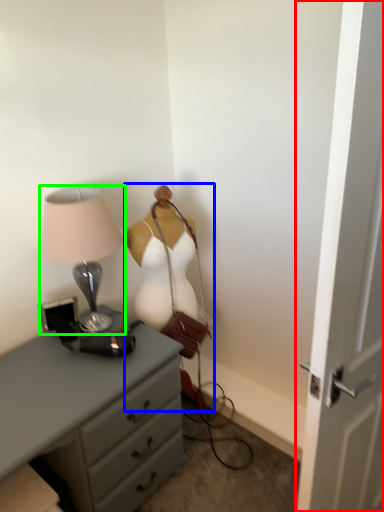
Question: Estimate the real-world distances between objects in this image. Which object is farther from door (highlighted by a red box), mannequin (highlighted by a blue box) or lamp (highlighted by a green box)?

Choices:
 (A) mannequin
 (B) lamp

Answer: (B)